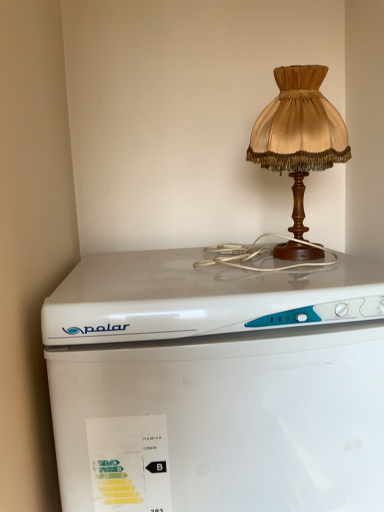
Question: In the image, is white plastic refrigerator at center on the left side or the right side of satin gold lampshade at upper right?

Choices:
 (A) left
 (B) right

Answer: (A)

Question: Relative to satin gold lampshade at upper right, is white plastic refrigerator at center in front or behind?

Choices:
 (A) behind
 (B) front

Answer: (B)

Question: From a real-world perspective, is white plastic refrigerator at center physically located above or below satin gold lampshade at upper right?

Choices:
 (A) below
 (B) above

Answer: (A)

Question: Relative to white plastic refrigerator at center, is satin gold lampshade at upper right in front or behind?

Choices:
 (A) behind
 (B) front

Answer: (A)

Question: Is satin gold lampshade at upper right spatially inside white plastic refrigerator at center, or outside of it?

Choices:
 (A) outside
 (B) inside

Answer: (A)

Question: From the image's perspective, is satin gold lampshade at upper right above or below white plastic refrigerator at center?

Choices:
 (A) above
 (B) below

Answer: (A)

Question: Considering the positions of satin gold lampshade at upper right and white plastic refrigerator at center in the image, is satin gold lampshade at upper right wider or thinner than white plastic refrigerator at center?

Choices:
 (A) thin
 (B) wide

Answer: (A)